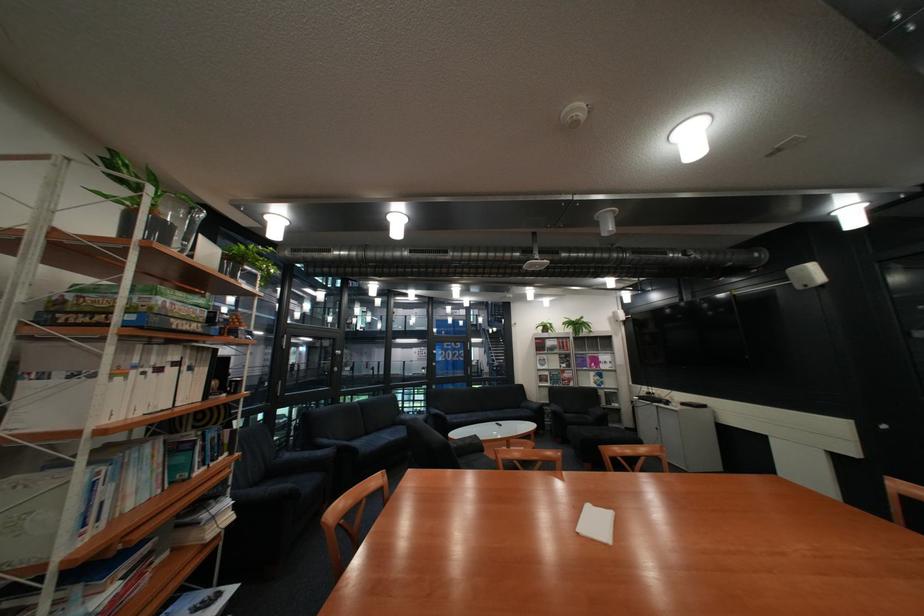
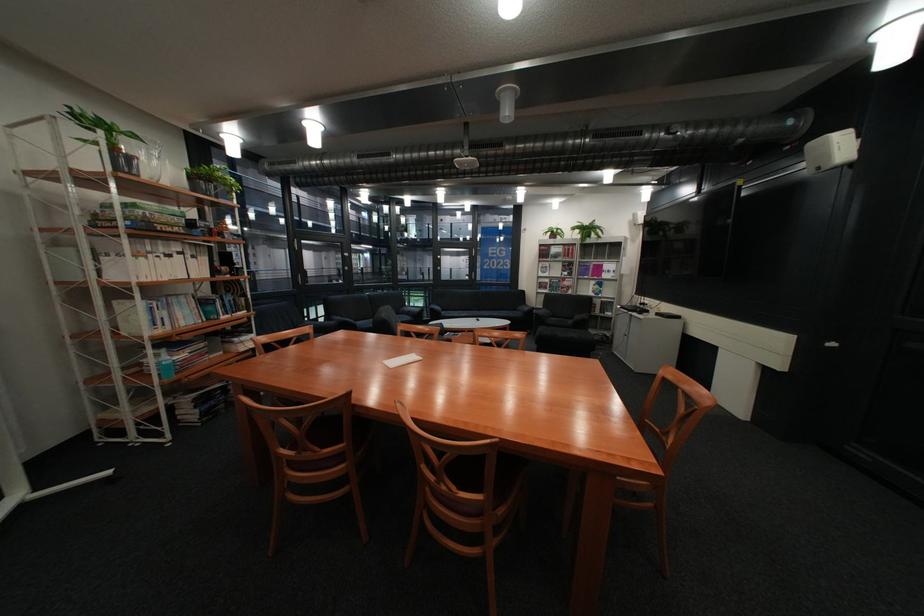
In the second image, find the point that corresponds to (x=612, y=224) in the first image.

(513, 108)